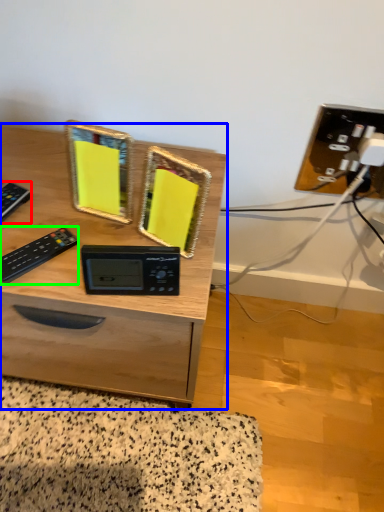
Question: Which object is the closest to the control (highlighted by a red box)? Choose among these: desk (highlighted by a blue box) or control (highlighted by a green box).

Choices:
 (A) desk
 (B) control

Answer: (B)